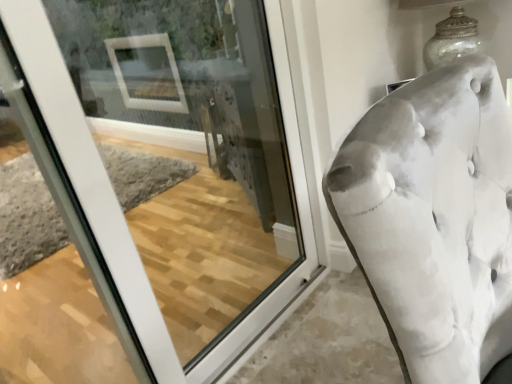
You are a GUI agent. You are given a task and a screenshot of the screen. Output one action in this format:
    pyautogui.click(x=<x>, y=<y>)
    Task: Click on the vacant region to the right of transparent glass window at center
    The image size is (512, 384).
    Given the screenshot: What is the action you would take?
    pyautogui.click(x=304, y=352)